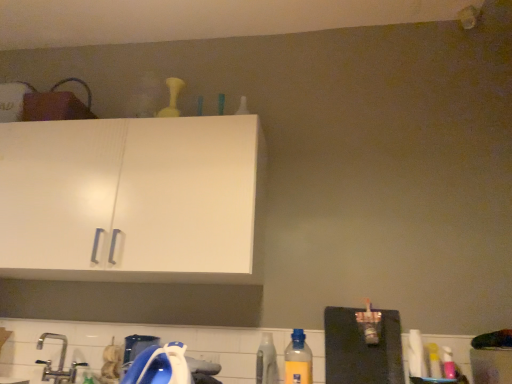
Question: From their relative heights in the image, would you say silver metallic faucet at lower left is taller or shorter than translucent plastic bottle at lower center, the 2th bottle in the front-to-back sequence?

Choices:
 (A) short
 (B) tall

Answer: (A)

Question: Relative to translucent plastic bottle at lower center, which is the 2th bottle from back to front, is silver metallic faucet at lower left in front or behind?

Choices:
 (A) behind
 (B) front

Answer: (A)

Question: Estimate the real-world distances between objects in this image. Which object is farther from the yellow matte bottle at upper center, which is counted as the 1th bottle, starting from the back?

Choices:
 (A) translucent plastic bottle at lower center, which is the 2th bottle from back to front
 (B) silver metallic faucet at lower left
 (C) yellow plastic bottle at lower center, the 1th bottle in the right-to-left sequence

Answer: (C)

Question: Estimate the real-world distances between objects in this image. Which object is farther from the yellow matte bottle at upper center, marked as the first bottle in a left-to-right arrangement?

Choices:
 (A) silver metallic faucet at lower left
 (B) translucent plastic bottle at lower center, the 2th bottle in the front-to-back sequence
 (C) yellow plastic bottle at lower center, the 1th bottle positioned from the front

Answer: (C)